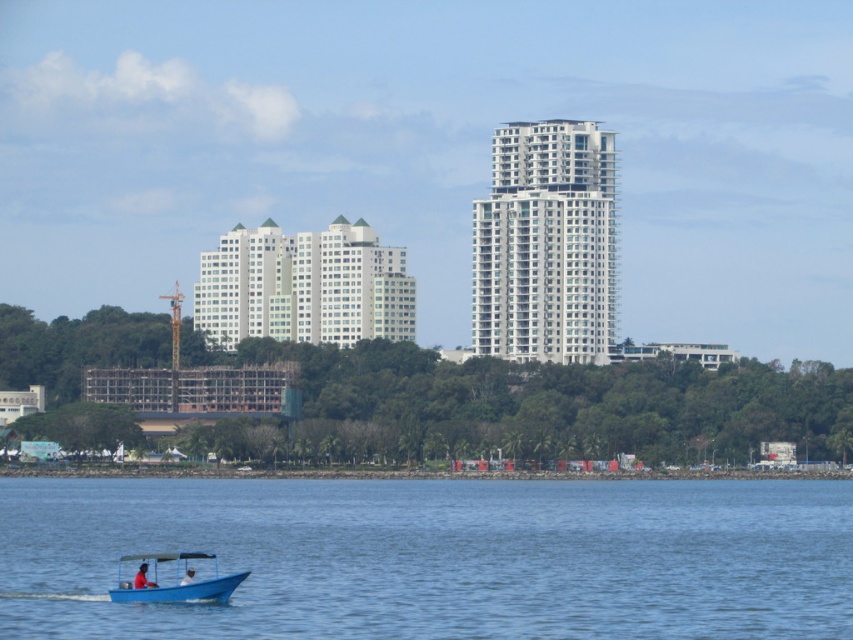
You are standing at the point marked by coordinates point (436, 557) in the image. What do you see around you?

You are standing at the coordinates point (436, 557), which corresponds to blue water at lower left. The surrounding area is part of the waterfront with gentle ripples on the water surface and the small motorized boat with a blue hull and canopy moving nearby.

You are a photographer planning to take a photo of the waterfront scene. You want to ensure that both the blue water at lower left and the blue plastic boat at lower left are clearly visible in the frame. Given their sizes, which object will occupy more space in your photo?

The blue water at lower left is bigger than the blue plastic boat at lower left, so it will occupy more space in the photo.

You are standing on the dock and looking at the blue water at lower left and the blue plastic boat at lower left. Which one appears taller from your viewpoint?

The blue water at lower left appears taller than the blue plastic boat at lower left.